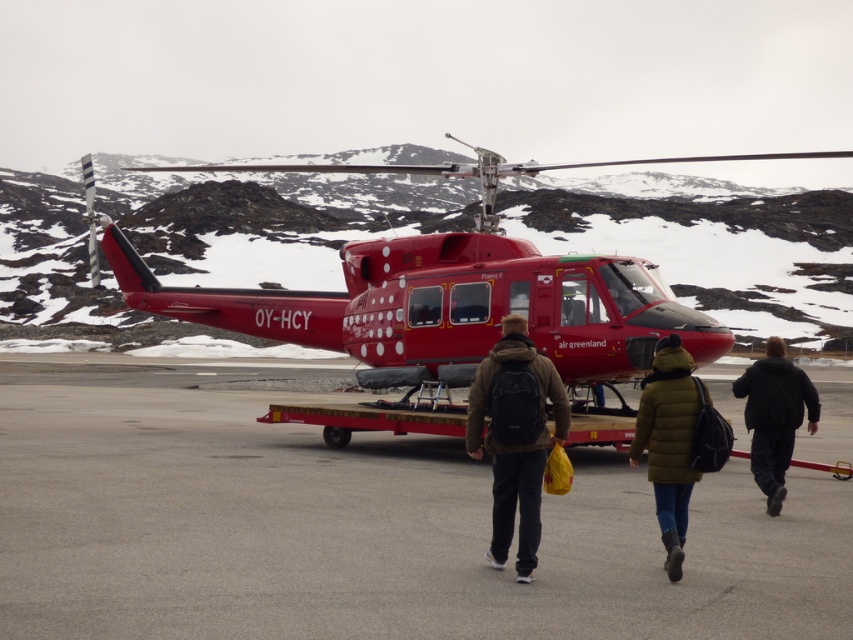
Is point (508, 336) less distant than point (746, 420)?

That is True.

What do you see at coordinates (515, 436) in the screenshot? Image resolution: width=853 pixels, height=640 pixels. I see `brown fabric backpack at center` at bounding box center [515, 436].

What are the coordinates of `brown fabric backpack at center` in the screenshot? It's located at (515, 436).

Does polished red helicopter at center appear under green down jacket at center?

No.

Does polished red helicopter at center have a lesser width compared to green down jacket at center?

Incorrect, polished red helicopter at center's width is not less than green down jacket at center's.

Is point (473, 339) positioned behind point (669, 454)?

Yes, point (473, 339) is behind point (669, 454).

Identify the location of polished red helicopter at center. The height and width of the screenshot is (640, 853). (448, 292).

Which is more to the right, smooth asphalt tarmac at center or brown fabric backpack at center?

From the viewer's perspective, smooth asphalt tarmac at center appears more on the right side.

Who is more forward, (9, 538) or (544, 362)?

Point (544, 362)

Find the location of a particular element. The image size is (853, 640). smooth asphalt tarmac at center is located at coordinates (360, 524).